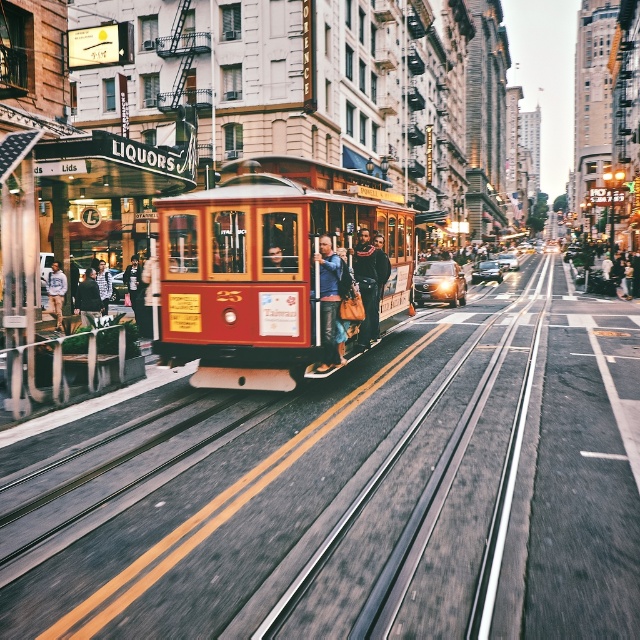
Question: Which point appears closest to the camera in this image?

Choices:
 (A) (332, 314)
 (B) (356, 340)
 (C) (84, 300)

Answer: (A)

Question: Is leather jacket at center wider than dark gray sweater at center?

Choices:
 (A) no
 (B) yes

Answer: (A)

Question: Which object is the closest to the leather jacket at center?

Choices:
 (A) wooden polished cable car at center
 (B) dark gray sweater at center

Answer: (A)

Question: Is dark brown leather jacket at center positioned before striped shirt at center?

Choices:
 (A) no
 (B) yes

Answer: (B)

Question: Is smooth leather jacket at center above striped shirt at center?

Choices:
 (A) no
 (B) yes

Answer: (B)

Question: Estimate the real-world distances between objects in this image. Which object is farther from the striped shirt at center?

Choices:
 (A) wooden polished cable car at center
 (B) dark brown leather jacket at center

Answer: (A)